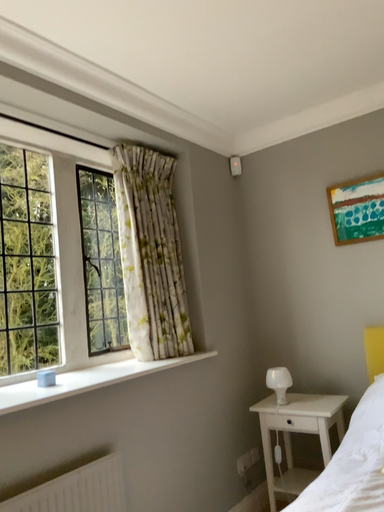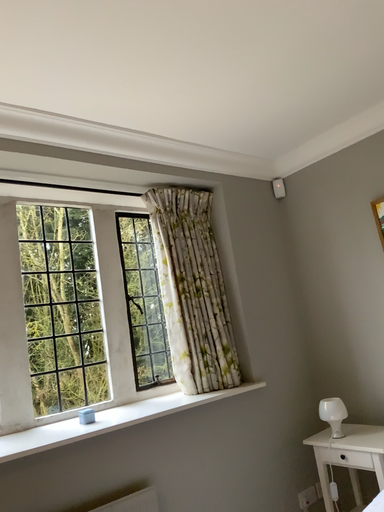
Question: How did the camera likely rotate when shooting the video?

Choices:
 (A) rotated right
 (B) rotated left

Answer: (B)